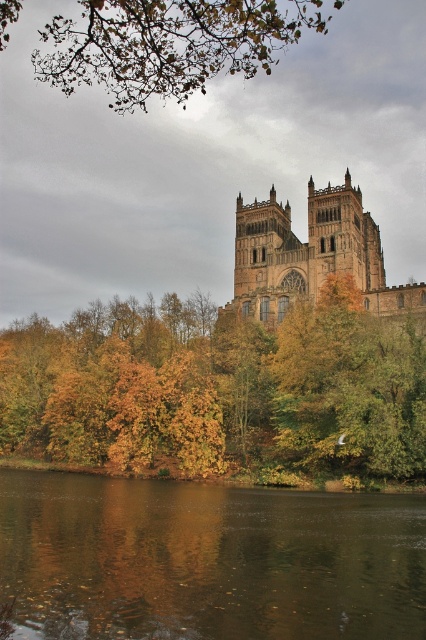
Does point (345, 472) come farther from viewer compared to point (328, 589)?

Yes, point (345, 472) is behind point (328, 589).

Is autumn leaves at center thinner than brown reflective water at lower center?

No.

Is point (351, 452) less distant than point (106, 632)?

No, (351, 452) is behind (106, 632).

You are a GUI agent. You are given a task and a screenshot of the screen. Output one action in this format:
    pyautogui.click(x=<x>, y=<y>)
    Task: Click on the autumn leaves at center
    
    Given the screenshot: What is the action you would take?
    coord(218,388)

Can you confirm if brown reflective water at lower center is wider than green leafy branches at upper center?

No, brown reflective water at lower center is not wider than green leafy branches at upper center.

Does brown reflective water at lower center appear on the left side of green leafy branches at upper center?

Correct, you'll find brown reflective water at lower center to the left of green leafy branches at upper center.

Where is `brown reflective water at lower center`? The height and width of the screenshot is (640, 426). brown reflective water at lower center is located at coordinates (207, 561).

Is point (310, 372) positioned in front of point (267, 230)?

Yes, point (310, 372) is in front of point (267, 230).

Can you confirm if autumn leaves at center is bigger than brown stone church at upper center?

Yes, autumn leaves at center is bigger than brown stone church at upper center.

Does point (334, 464) come farther from viewer compared to point (423, 291)?

No, (334, 464) is closer to viewer.

Locate an element on the screen. autumn leaves at center is located at coordinates (218, 388).